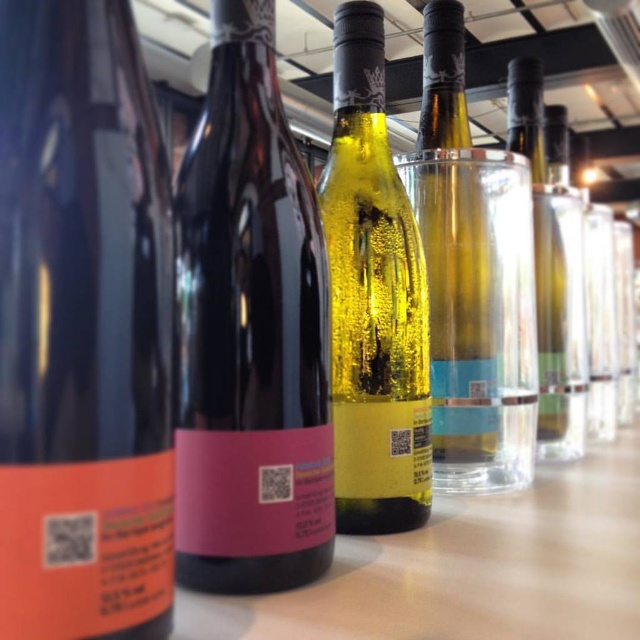
Between shiny black bottle at center and clear glass bottle at right, which one has more height?

Standing taller between the two is clear glass bottle at right.

At what (x,y) coordinates should I click in order to perform the action: click on shiny black bottle at center. Please return your answer as a coordinate pair (x, y). The width and height of the screenshot is (640, 640). Looking at the image, I should click on (83, 328).

The height and width of the screenshot is (640, 640). I want to click on shiny black bottle at center, so click(x=83, y=328).

This screenshot has height=640, width=640. Describe the element at coordinates (250, 332) in the screenshot. I see `matte black bottle at center` at that location.

Which is behind, point (292, 442) or point (344, 232)?

The point (344, 232) is behind.

Is point (294, 209) farther from camera compared to point (413, 305)?

No, it is not.

At what (x,y) coordinates should I click in order to perform the action: click on matte black bottle at center. Please return your answer as a coordinate pair (x, y). This screenshot has height=640, width=640. Looking at the image, I should click on (250, 332).

Is matte black bottle at center above clear glass bottle at right?

Incorrect, matte black bottle at center is not positioned above clear glass bottle at right.

Who is shorter, matte black bottle at center or clear glass bottle at right?

Standing shorter between the two is matte black bottle at center.

Does point (276, 509) come behind point (557, 460)?

No, (276, 509) is closer to viewer.

The width and height of the screenshot is (640, 640). Find the location of `matte black bottle at center`. matte black bottle at center is located at coordinates (250, 332).